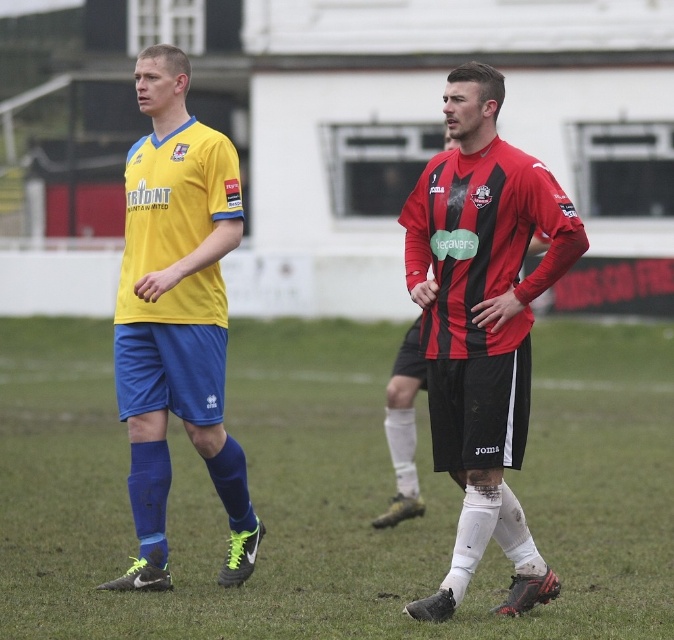
Can you confirm if yellow matte jersey at left is positioned above yellow matte jersey at center?

Incorrect, yellow matte jersey at left is not positioned above yellow matte jersey at center.

Is point (506, 378) behind point (137, 324)?

No, it is not.

Locate an element on the screen. This screenshot has width=674, height=640. yellow matte jersey at left is located at coordinates (483, 323).

Between matte red and black jersey at center and yellow matte jersey at center, which one appears on the left side from the viewer's perspective?

yellow matte jersey at center is more to the left.

Who is positioned more to the right, matte red and black jersey at center or yellow matte jersey at center?

Positioned to the right is matte red and black jersey at center.

Locate an element on the screen. Image resolution: width=674 pixels, height=640 pixels. matte red and black jersey at center is located at coordinates (483, 324).

Can you confirm if green grass at center is shorter than matte red and black jersey at center?

Yes.

Who is lower down, green grass at center or matte red and black jersey at center?

green grass at center is below.

Find the location of a particular element. This screenshot has height=640, width=674. green grass at center is located at coordinates (332, 490).